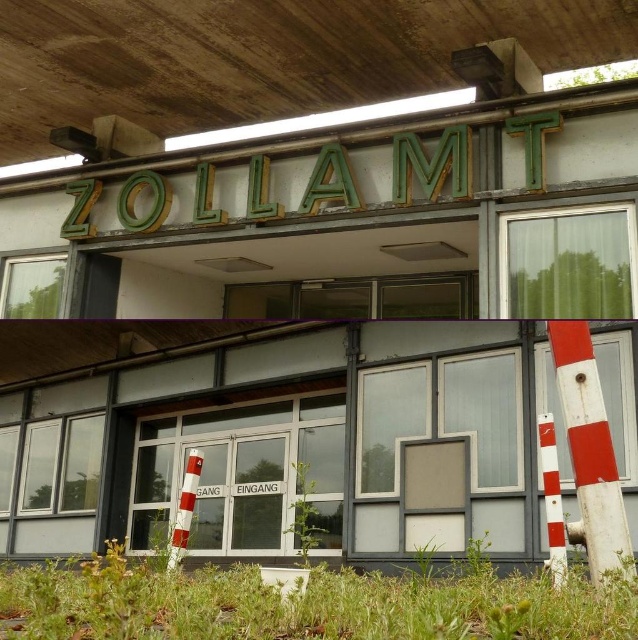
You are a delivery person trying to enter the building through the transparent glass door at center. There is a white striped cone at lower right blocking the entrance. Can you pass through the entrance without moving the cone?

The transparent glass door at center is wider than the white striped cone at lower right, so you can pass through the entrance without moving the cone as there is enough space.

You are standing in front of the ZOLLAMT building and want to enter through the entrance marked with the words GANZ EINGANG. Where is the transparent glass door at center located in relation to the entrance sign?

The transparent glass door at center is located at point [322,440], which is the entrance marked with the words GANG EINGANG.